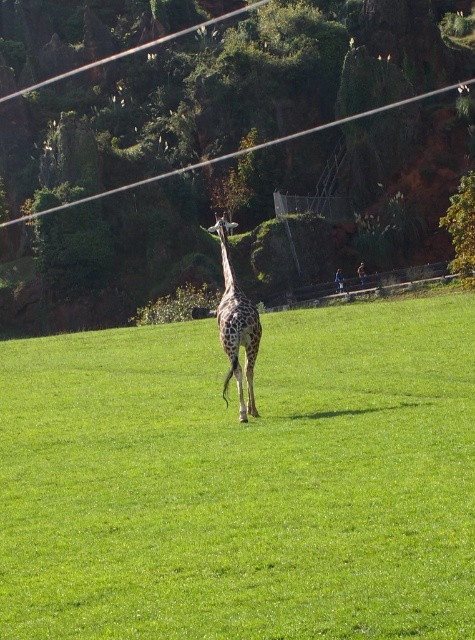
Find the location of a particular element. The height and width of the screenshot is (640, 475). green grass at center is located at coordinates (x=243, y=481).

Find the location of `green grass at center`. green grass at center is located at coordinates (243, 481).

Find the location of `green grass at center`. green grass at center is located at coordinates (243, 481).

Is point (51, 209) positioned behind point (464, 236)?

Yes, point (51, 209) is behind point (464, 236).

Who is lower down, transparent plastic power line at upper center or green leafy tree at upper center?

Positioned lower is green leafy tree at upper center.

Where is `transparent plastic power line at upper center`? The width and height of the screenshot is (475, 640). transparent plastic power line at upper center is located at coordinates pyautogui.click(x=238, y=152).

Does point (247, 408) come behind point (100, 195)?

No, (247, 408) is closer to viewer.

Based on the photo, can you confirm if spotted fur giraffe at center is bigger than transparent plastic power line at upper center?

Actually, spotted fur giraffe at center might be smaller than transparent plastic power line at upper center.

Where is `spotted fur giraffe at center`? This screenshot has height=640, width=475. spotted fur giraffe at center is located at coordinates (237, 326).